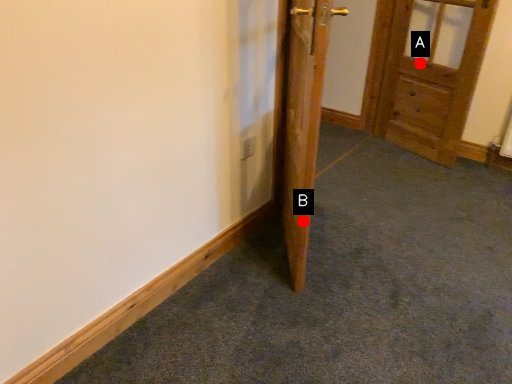
Question: Two points are circled on the image, labeled by A and B beside each circle. Which point is farther to the camera?

Choices:
 (A) A is further
 (B) B is further

Answer: (A)